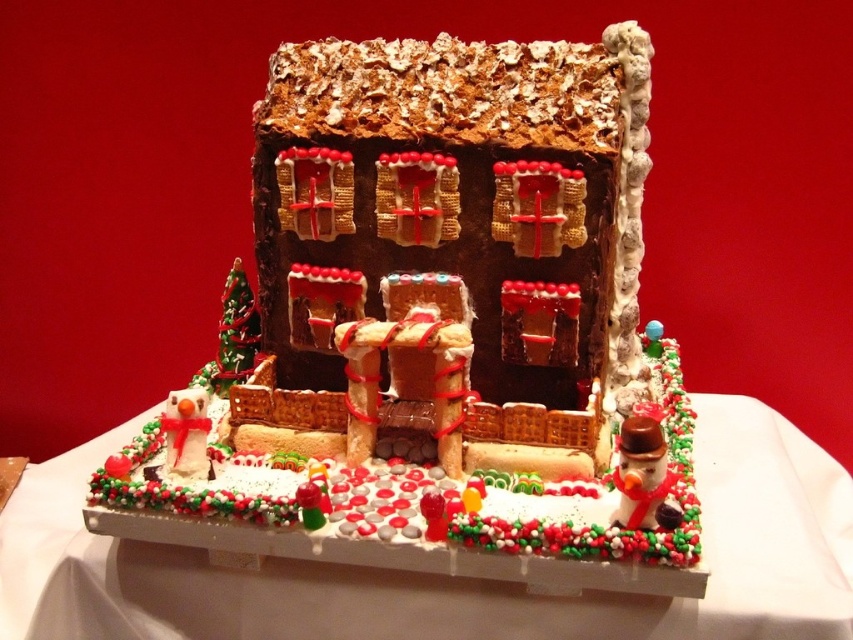
You are a child who is 1.2 meters tall and standing in front of the chocolate gingerbread house at center. If you want to reach the top of the house, will you be able to touch it without standing on something?

The chocolate gingerbread house at center is 1.14 meters away from the camera, but the question is about height. The description provided does not mention the height of the house, so we cannot determine if the child can reach the top based on the given information.

You are planning to place a decorative candy cane on the wider object between the chocolate gingerbread house at center and the white frosted cake at center. Which object should you choose?

The white frosted cake at center is wider than the chocolate gingerbread house at center, so you should place the decorative candy cane on the white frosted cake at center.

You are a guest at a holiday party and see both the chocolate gingerbread house at center and the white frosted cake at center. Which one is placed higher up in the image?

The chocolate gingerbread house at center is placed higher up in the image than the white frosted cake at center.